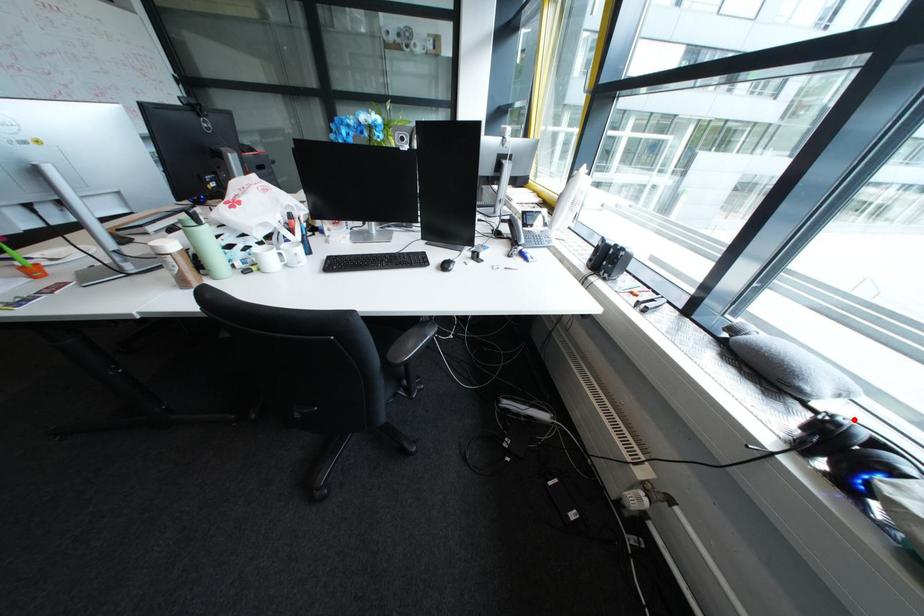
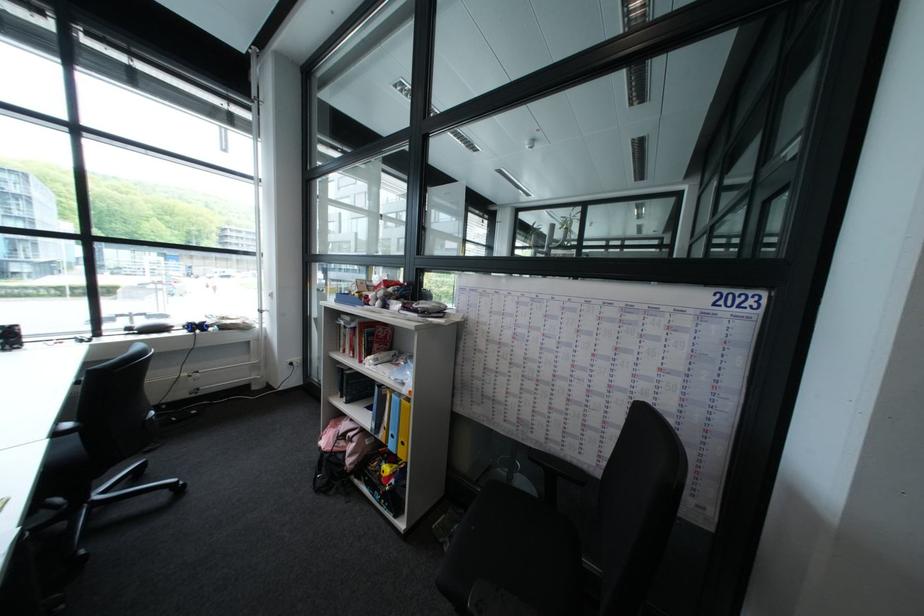
Find the pixel in the second image that matches the highlighted location in the first image.

(203, 322)